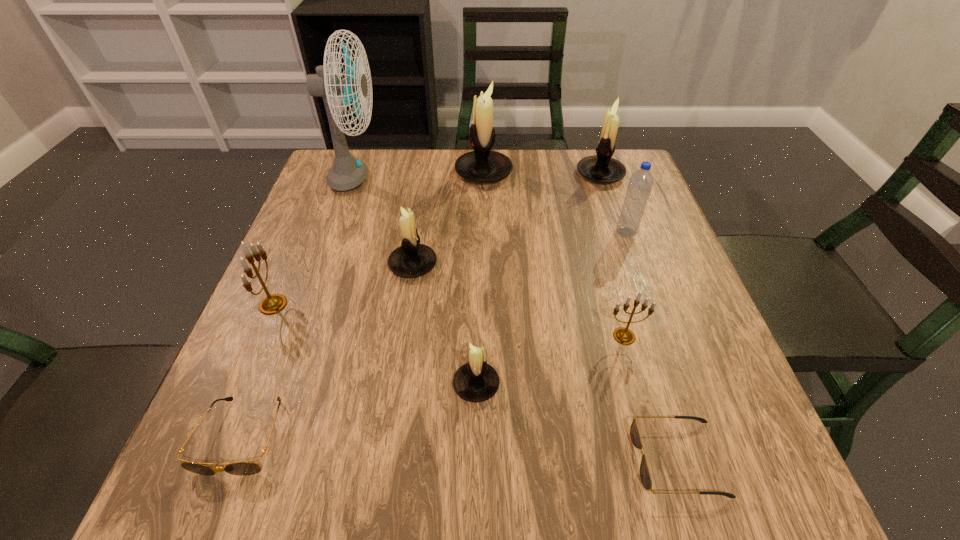
The width and height of the screenshot is (960, 540). I want to click on the leftmost candle holder, so coord(271,304).

The image size is (960, 540). In order to click on the fifth nearest object in this screenshot , I will do `click(271, 304)`.

Locate an element on the screen. the fourth nearest object is located at coordinates (622, 335).

I want to click on the right gold candelabrum, so click(x=622, y=335).

Image resolution: width=960 pixels, height=540 pixels. I want to click on the nearest candle holder, so click(476, 381).

Where is `the smallest white candle holder`? This screenshot has width=960, height=540. the smallest white candle holder is located at coordinates (476, 381).

Locate an element on the screen. The width and height of the screenshot is (960, 540). the left black sunglasses is located at coordinates (246, 468).

Identify the location of the right sunglasses. This screenshot has width=960, height=540. (645, 476).

You are a GUI agent. You are given a task and a screenshot of the screen. Output one action in this format:
    pyautogui.click(x=<x>, y=<y>)
    Task: Click on the vacant space located on the front-facing side of the fan
    The height and width of the screenshot is (540, 960).
    Given the screenshot: What is the action you would take?
    pyautogui.click(x=419, y=180)

You are a GUI agent. You are given a task and a screenshot of the screen. Output one action in this format:
    pyautogui.click(x=<x>, y=<y>)
    Task: Click on the blank area located on the front of the biggest white candle holder
    The height and width of the screenshot is (540, 960).
    Given the screenshot: What is the action you would take?
    pyautogui.click(x=485, y=260)